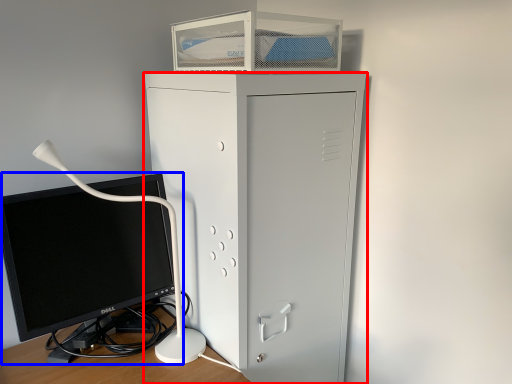
Question: Which point is further to the camera, furniture (highlighted by a red box) or computer monitor (highlighted by a blue box)?

Choices:
 (A) furniture
 (B) computer monitor

Answer: (A)